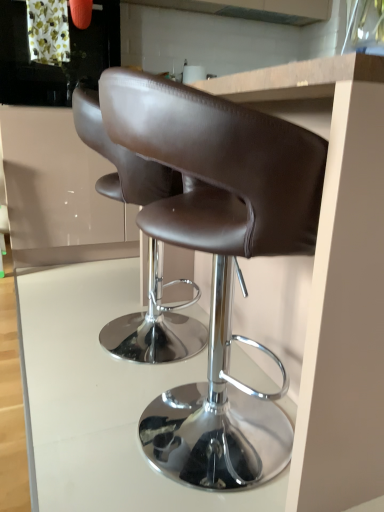
Image resolution: width=384 pixels, height=512 pixels. I want to click on matte white cabinet at upper left, so click(53, 182).

In the scene shown: Does brown leather stool at center, which appears as the second chair when viewed from the back, appear on the left side of brown leather stool at center, which appears as the 1th chair when viewed from the back?

No.

From the image's perspective, would you say brown leather stool at center, which is counted as the 1th chair, starting from the front, is shown under brown leather stool at center, which appears as the 1th chair when viewed from the back?

Yes.

Is brown leather stool at center, which appears as the second chair when viewed from the back, located outside brown leather stool at center, which appears as the 1th chair when viewed from the back?

Yes, brown leather stool at center, which appears as the second chair when viewed from the back, is located beyond the bounds of brown leather stool at center, which appears as the 1th chair when viewed from the back.

Is brown leather stool at center, which is counted as the 1th chair, starting from the front, bigger or smaller than brown leather stool at center, which appears as the 1th chair when viewed from the back?

brown leather stool at center, which is counted as the 1th chair, starting from the front, is smaller than brown leather stool at center, which appears as the 1th chair when viewed from the back.

Is white glossy table at center in contact with brown leather stool at center, which is counted as the 1th chair, starting from the front?

No.

From the image's perspective, is white glossy table at center located above or below brown leather stool at center, which appears as the second chair when viewed from the back?

white glossy table at center is situated lower than brown leather stool at center, which appears as the second chair when viewed from the back, in the image.

Considering their positions, is white glossy table at center located in front of or behind brown leather stool at center, which is counted as the 1th chair, starting from the front?

white glossy table at center is positioned farther from the viewer than brown leather stool at center, which is counted as the 1th chair, starting from the front.

Which of these two, white glossy table at center or brown leather stool at center, which is counted as the 1th chair, starting from the front, is thinner?

brown leather stool at center, which is counted as the 1th chair, starting from the front.

Is point (166, 118) positioned in front of point (245, 8)?

Yes, point (166, 118) is closer to viewer.

Is metallic gray exhaust hood at upper center inside brown leather stool at center, which appears as the second chair when viewed from the back?

Actually, metallic gray exhaust hood at upper center is outside brown leather stool at center, which appears as the second chair when viewed from the back.

Is brown leather stool at center, which appears as the second chair when viewed from the back, to the right of metallic gray exhaust hood at upper center from the viewer's perspective?

Incorrect, brown leather stool at center, which appears as the second chair when viewed from the back, is not on the right side of metallic gray exhaust hood at upper center.

Can you confirm if brown leather stool at center, which is counted as the 1th chair, starting from the front, is taller than metallic gray exhaust hood at upper center?

Yes.

From a real-world perspective, is brown leather stool at center, which appears as the 1th chair when viewed from the back, over brown leather stool at center, which appears as the second chair when viewed from the back?

No, from a real-world perspective, brown leather stool at center, which appears as the 1th chair when viewed from the back, is not above brown leather stool at center, which appears as the second chair when viewed from the back.

Which point is more forward, (x=158, y=309) or (x=241, y=176)?

Positioned in front is point (x=241, y=176).

Can you confirm if brown leather stool at center, which appears as the 1th chair when viewed from the back, is wider than brown leather stool at center, which is counted as the 1th chair, starting from the front?

Correct, the width of brown leather stool at center, which appears as the 1th chair when viewed from the back, exceeds that of brown leather stool at center, which is counted as the 1th chair, starting from the front.

Is brown leather stool at center, acting as the second chair starting from the front, shorter than matte white cabinet at upper left?

Indeed, brown leather stool at center, acting as the second chair starting from the front, has a lesser height compared to matte white cabinet at upper left.

Is point (154, 337) in front of point (46, 153)?

That is True.

Can you tell me how much brown leather stool at center, which appears as the 1th chair when viewed from the back, and matte white cabinet at upper left differ in facing direction?

There is a 90-degree angle between the facing directions of brown leather stool at center, which appears as the 1th chair when viewed from the back, and matte white cabinet at upper left.

Could you tell me if brown leather stool at center, which appears as the 1th chair when viewed from the back, is turned towards matte white cabinet at upper left?

No, brown leather stool at center, which appears as the 1th chair when viewed from the back, is not oriented towards matte white cabinet at upper left.

From a real-world perspective, is brown leather stool at center, which appears as the second chair when viewed from the back, positioned over matte white cabinet at upper left based on gravity?

No, from a real-world perspective, brown leather stool at center, which appears as the second chair when viewed from the back, is not over matte white cabinet at upper left

Is brown leather stool at center, which is counted as the 1th chair, starting from the front, to the left of matte white cabinet at upper left from the viewer's perspective?

No.

From the image's perspective, which object appears higher, brown leather stool at center, which is counted as the 1th chair, starting from the front, or matte white cabinet at upper left?

matte white cabinet at upper left.

Is brown leather stool at center, which appears as the second chair when viewed from the back, situated inside matte white cabinet at upper left or outside?

brown leather stool at center, which appears as the second chair when viewed from the back, cannot be found inside matte white cabinet at upper left.

In the scene shown: How much distance is there between white glossy table at center and brown leather stool at center, acting as the second chair starting from the front?

9.31 inches.

Does white glossy table at center have a lesser width compared to brown leather stool at center, which appears as the 1th chair when viewed from the back?

No, white glossy table at center is not thinner than brown leather stool at center, which appears as the 1th chair when viewed from the back.

Is point (96, 370) closer or farther from the camera than point (145, 199)?

Point (96, 370) is positioned farther from the camera compared to point (145, 199).

From a real-world perspective, does white glossy table at center sit lower than brown leather stool at center, which appears as the 1th chair when viewed from the back?

Yes, from a real-world perspective, white glossy table at center is below brown leather stool at center, which appears as the 1th chair when viewed from the back.

Locate an element on the screen. This screenshot has width=384, height=512. chair lying on the left of brown leather stool at center, which is counted as the 1th chair, starting from the front is located at coordinates (155, 324).

The height and width of the screenshot is (512, 384). In order to click on table below the brown leather stool at center, which is counted as the 1th chair, starting from the front (from a real-world perspective) in this screenshot , I will do tap(89, 389).

Looking at the image, which one is located further to matte white cabinet at upper left, metallic gray exhaust hood at upper center or brown leather stool at center, which appears as the second chair when viewed from the back?

The object further to matte white cabinet at upper left is metallic gray exhaust hood at upper center.

Considering their positions, is white glossy table at center positioned further to brown leather stool at center, which appears as the second chair when viewed from the back, than brown leather stool at center, which appears as the 1th chair when viewed from the back?

brown leather stool at center, which appears as the 1th chair when viewed from the back, is further to brown leather stool at center, which appears as the second chair when viewed from the back.

Considering their positions, is white glossy table at center positioned further to brown leather stool at center, which appears as the 1th chair when viewed from the back, than brown leather stool at center, which is counted as the 1th chair, starting from the front?

brown leather stool at center, which is counted as the 1th chair, starting from the front, is positioned further to the anchor brown leather stool at center, which appears as the 1th chair when viewed from the back.

Considering their positions, is white glossy table at center positioned further to brown leather stool at center, which is counted as the 1th chair, starting from the front, than metallic gray exhaust hood at upper center?

metallic gray exhaust hood at upper center.

Estimate the real-world distances between objects in this image. Which object is closer to brown leather stool at center, which appears as the second chair when viewed from the back, brown leather stool at center, acting as the second chair starting from the front, or white glossy table at center?

white glossy table at center is positioned closer to the anchor brown leather stool at center, which appears as the second chair when viewed from the back.

When comparing their distances from white glossy table at center, does metallic gray exhaust hood at upper center or matte white cabinet at upper left seem closer?

matte white cabinet at upper left.

Considering their positions, is matte white cabinet at upper left positioned further to brown leather stool at center, acting as the second chair starting from the front, than brown leather stool at center, which appears as the second chair when viewed from the back?

matte white cabinet at upper left lies further to brown leather stool at center, acting as the second chair starting from the front, than the other object.

When comparing their distances from white glossy table at center, does brown leather stool at center, which is counted as the 1th chair, starting from the front, or brown leather stool at center, which appears as the 1th chair when viewed from the back, seem closer?

brown leather stool at center, which appears as the 1th chair when viewed from the back, is closer to white glossy table at center.

Where is `cabinetry located between brown leather stool at center, which appears as the 1th chair when viewed from the back, and metallic gray exhaust hood at upper center in the depth direction`? The width and height of the screenshot is (384, 512). cabinetry located between brown leather stool at center, which appears as the 1th chair when viewed from the back, and metallic gray exhaust hood at upper center in the depth direction is located at coordinates (53, 182).

At what (x,y) coordinates should I click in order to perform the action: click on chair positioned between brown leather stool at center, which is counted as the 1th chair, starting from the front, and matte white cabinet at upper left from near to far. Please return your answer as a coordinate pair (x, y). Looking at the image, I should click on (155, 324).

Find the location of a particular element. The height and width of the screenshot is (512, 384). table located between brown leather stool at center, which appears as the second chair when viewed from the back, and metallic gray exhaust hood at upper center in the depth direction is located at coordinates 89,389.

Find the location of a particular element. table between brown leather stool at center, which appears as the second chair when viewed from the back, and brown leather stool at center, acting as the second chair starting from the front, in the front-back direction is located at coordinates (89, 389).